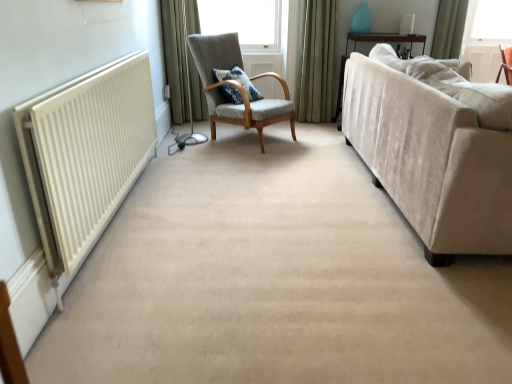
Question: Is green fabric curtain at upper right, which is counted as the 3th curtain, starting from the left, beside green velvet curtain at upper center, marked as the second curtain in a left-to-right arrangement?

Choices:
 (A) no
 (B) yes

Answer: (A)

Question: Can green velvet curtain at upper center, marked as the second curtain in a left-to-right arrangement, be found inside green fabric curtain at upper right, which is counted as the 3th curtain, starting from the left?

Choices:
 (A) yes
 (B) no

Answer: (B)

Question: Considering the relative positions of green fabric curtain at upper right, which is counted as the 3th curtain, starting from the left, and green velvet curtain at upper center, placed as the second curtain when sorted from right to left, in the image provided, is green fabric curtain at upper right, which is counted as the 3th curtain, starting from the left, to the left of green velvet curtain at upper center, placed as the second curtain when sorted from right to left, from the viewer's perspective?

Choices:
 (A) no
 (B) yes

Answer: (A)

Question: Does green fabric curtain at upper right, which is counted as the 3th curtain, starting from the left, lie behind green velvet curtain at upper center, placed as the second curtain when sorted from right to left?

Choices:
 (A) yes
 (B) no

Answer: (A)

Question: Would you consider green fabric curtain at upper right, marked as the 1th curtain in a right-to-left arrangement, to be distant from green velvet curtain at upper center, placed as the second curtain when sorted from right to left?

Choices:
 (A) yes
 (B) no

Answer: (A)

Question: Is green fabric curtain at upper right, which is counted as the 3th curtain, starting from the left, wider than green velvet curtain at upper center, placed as the second curtain when sorted from right to left?

Choices:
 (A) yes
 (B) no

Answer: (A)

Question: From the image's perspective, would you say blue patterned cushion at center is positioned over beige velvet couch at right?

Choices:
 (A) no
 (B) yes

Answer: (B)

Question: Is blue patterned cushion at center oriented towards beige velvet couch at right?

Choices:
 (A) yes
 (B) no

Answer: (A)

Question: Is blue patterned cushion at center bigger than beige velvet couch at right?

Choices:
 (A) no
 (B) yes

Answer: (A)

Question: From a real-world perspective, is blue patterned cushion at center located beneath beige velvet couch at right?

Choices:
 (A) no
 (B) yes

Answer: (A)

Question: Is blue patterned cushion at center positioned in front of beige velvet couch at right?

Choices:
 (A) yes
 (B) no

Answer: (B)

Question: Is blue patterned cushion at center taller than beige velvet couch at right?

Choices:
 (A) no
 (B) yes

Answer: (A)

Question: Is white matte radiator at left thinner than green fabric curtain at upper right, which is counted as the 3th curtain, starting from the left?

Choices:
 (A) no
 (B) yes

Answer: (B)